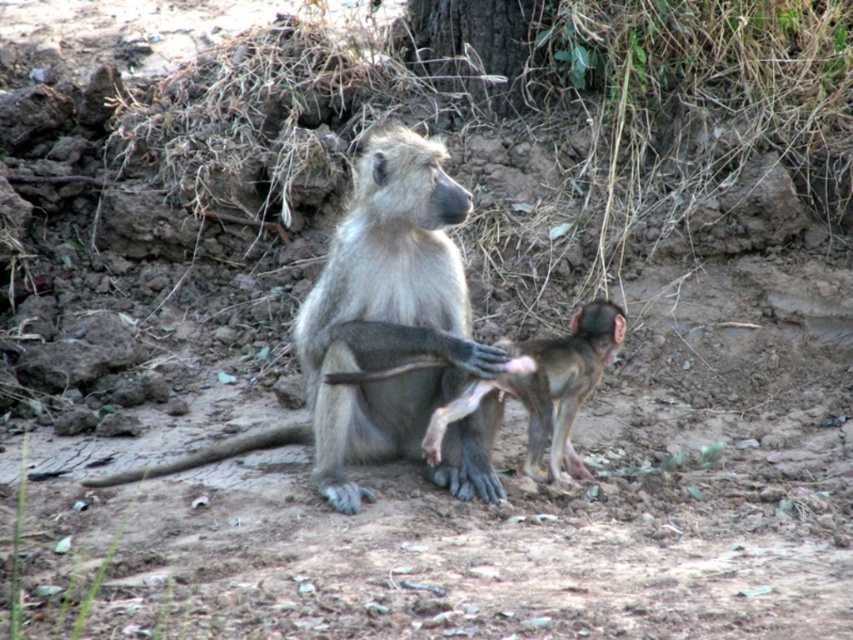
Question: In this image, where is gray fur monkey at center located relative to smooth brown monkey at center?

Choices:
 (A) left
 (B) right

Answer: (A)

Question: Among these objects, which one is farthest from the camera?

Choices:
 (A) gray fur monkey at center
 (B) smooth brown monkey at center

Answer: (B)

Question: Which of the following is the farthest from the observer?

Choices:
 (A) click(x=564, y=340)
 (B) click(x=440, y=172)

Answer: (A)

Question: Does gray fur monkey at center appear on the right side of smooth brown monkey at center?

Choices:
 (A) no
 (B) yes

Answer: (A)

Question: Can you confirm if gray fur monkey at center is positioned above smooth brown monkey at center?

Choices:
 (A) yes
 (B) no

Answer: (A)